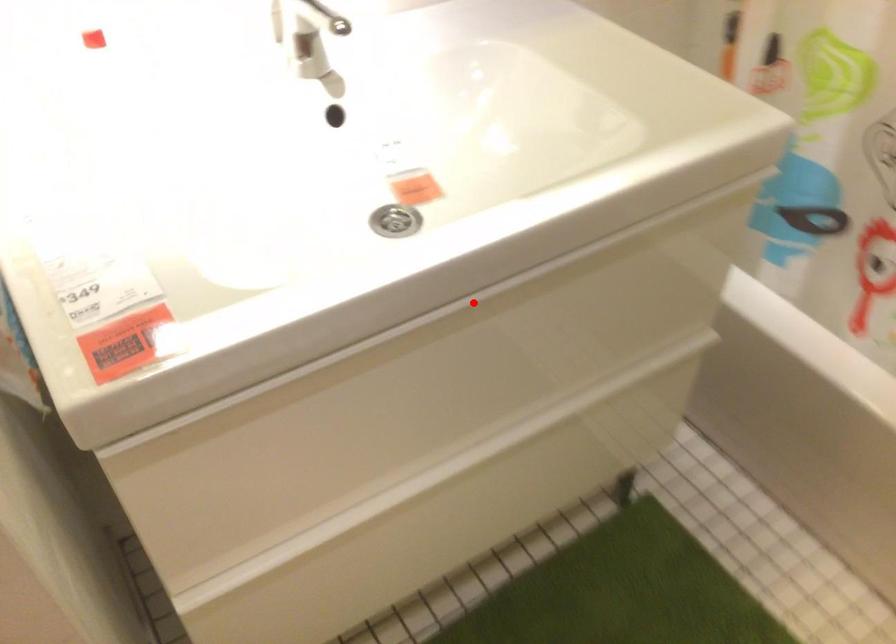
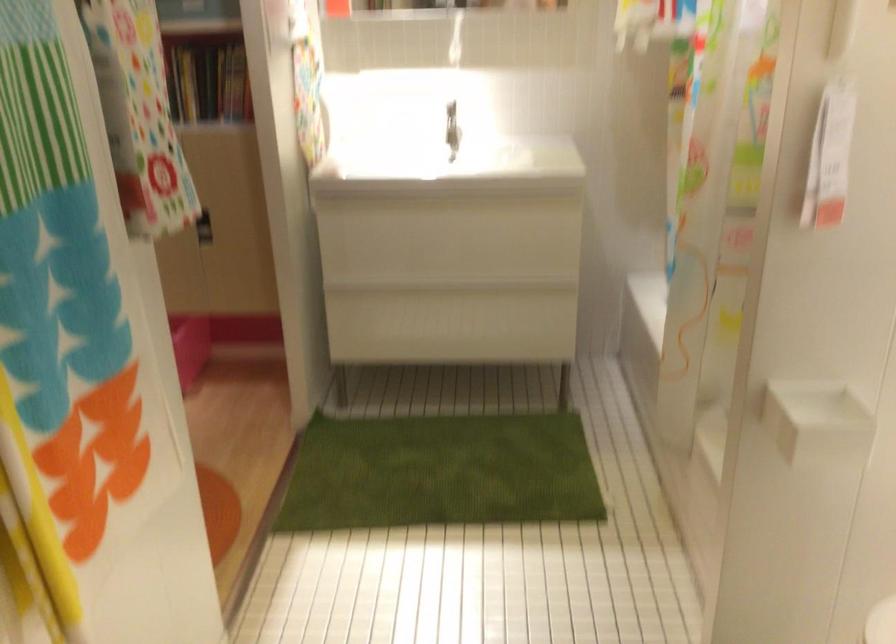
Question: I am providing you with two images of the same scene from different viewpoints. Image1 has a red point marked. In image2, the corresponding 3D location appears at what relative position? Reply with the corresponding letter.

Choices:
 (A) Closer
 (B) Farther

Answer: (B)